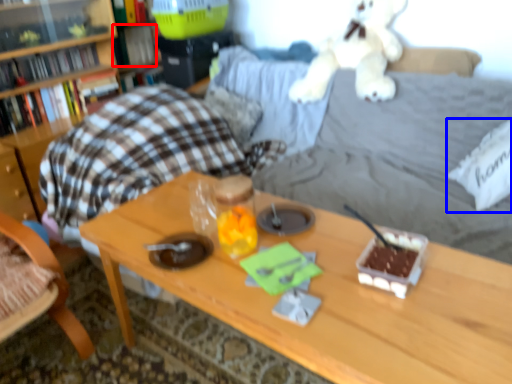
Question: Which object is closer to the camera taking this photo, book (highlighted by a red box) or pillow (highlighted by a blue box)?

Choices:
 (A) book
 (B) pillow

Answer: (B)